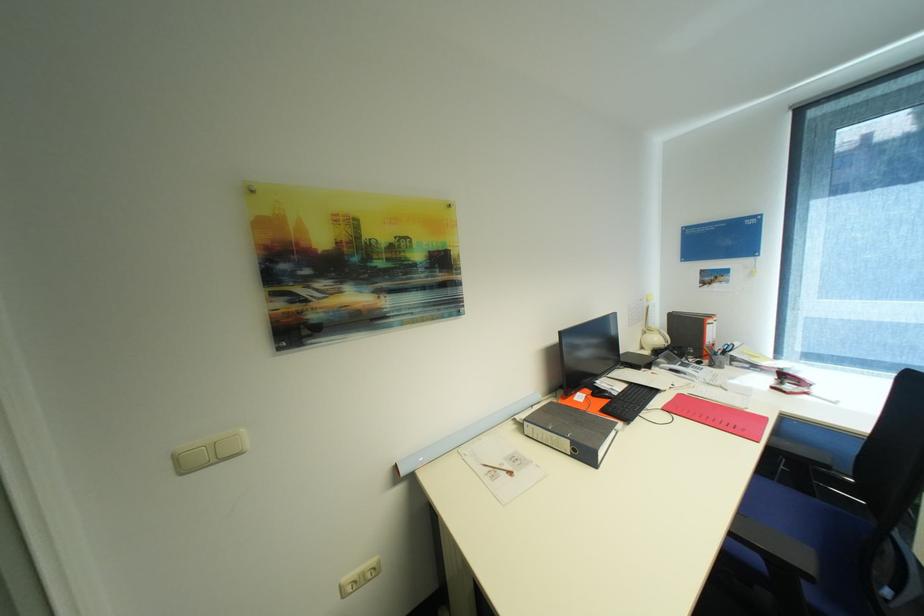
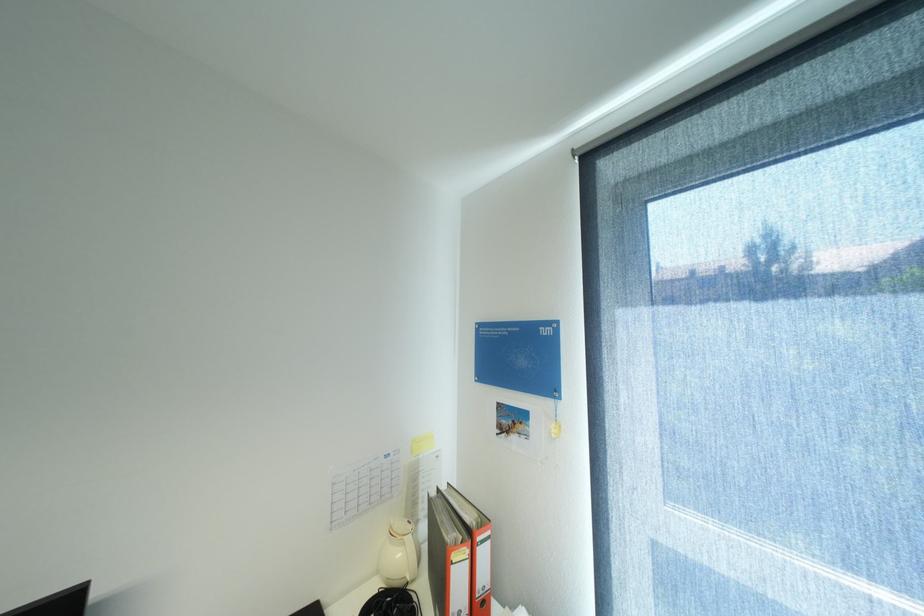
Find the pixel in the second image that matches pixel 663 339 in the first image.

(407, 554)